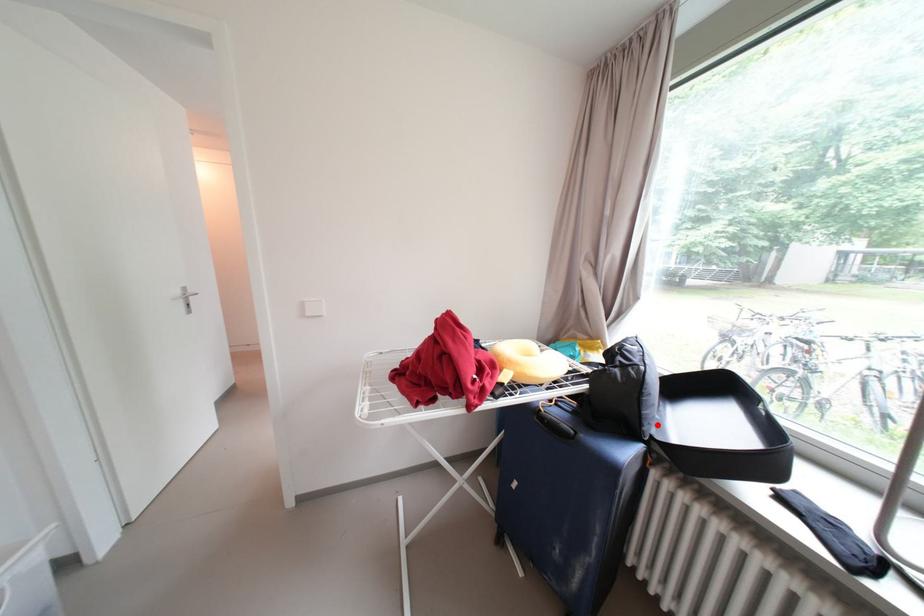
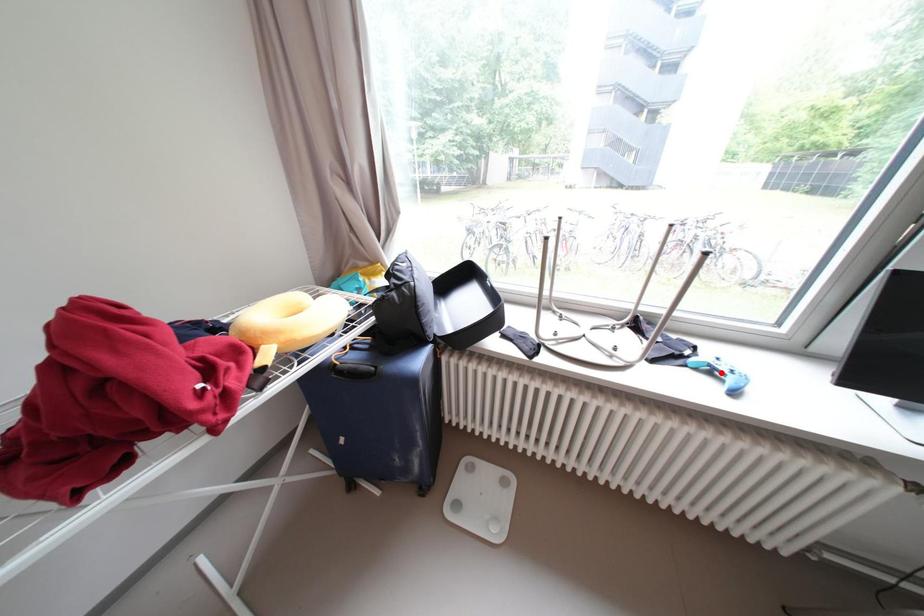
I am providing you with two images of the same scene from different viewpoints. A red point is marked on the first image and another point is marked on the second image. Is the marked point in image1 the same physical position as the marked point in image2?

No